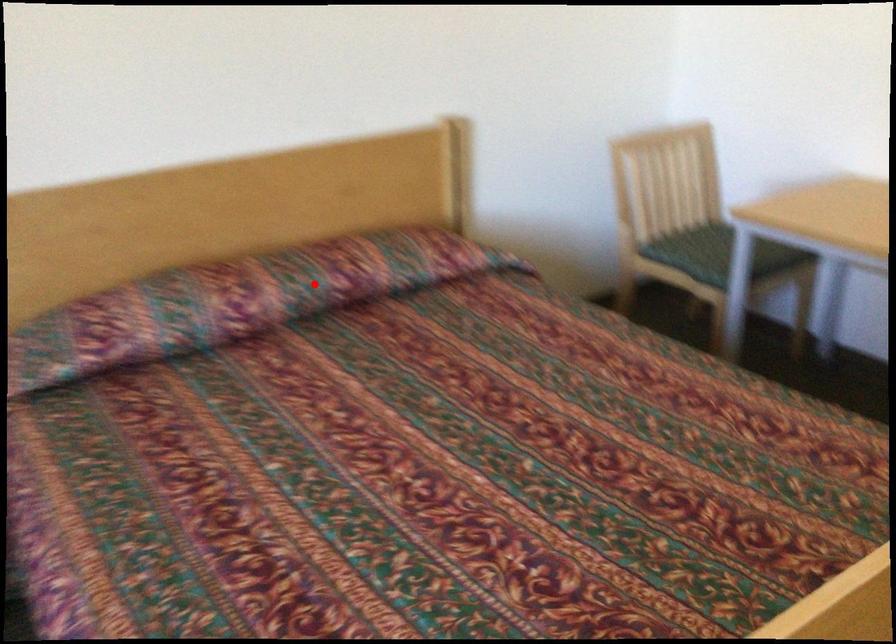
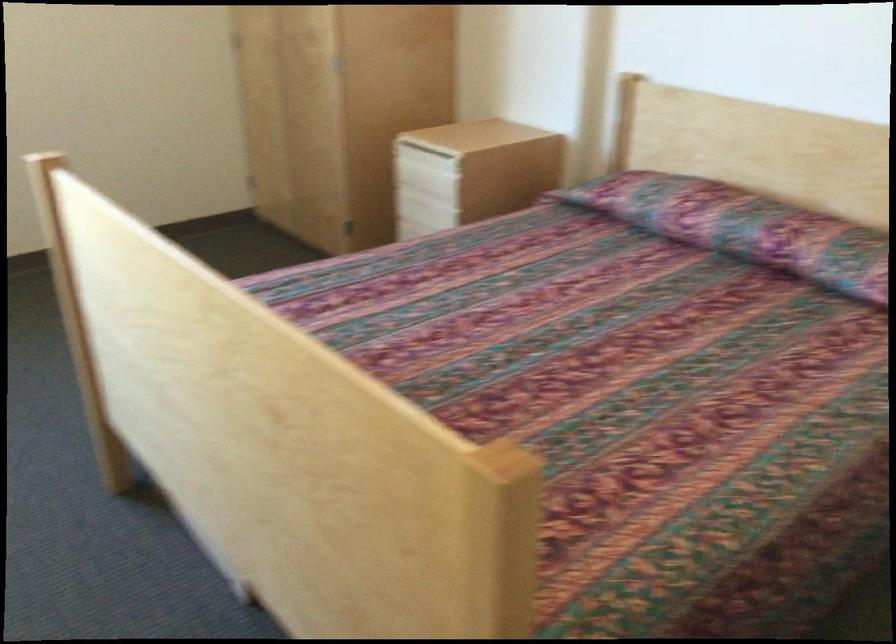
Question: I am providing you with two images of the same scene from different viewpoints. A red point is marked on the first image. Can you still see the location of the red point in image 2?

Choices:
 (A) Yes
 (B) No

Answer: (A)